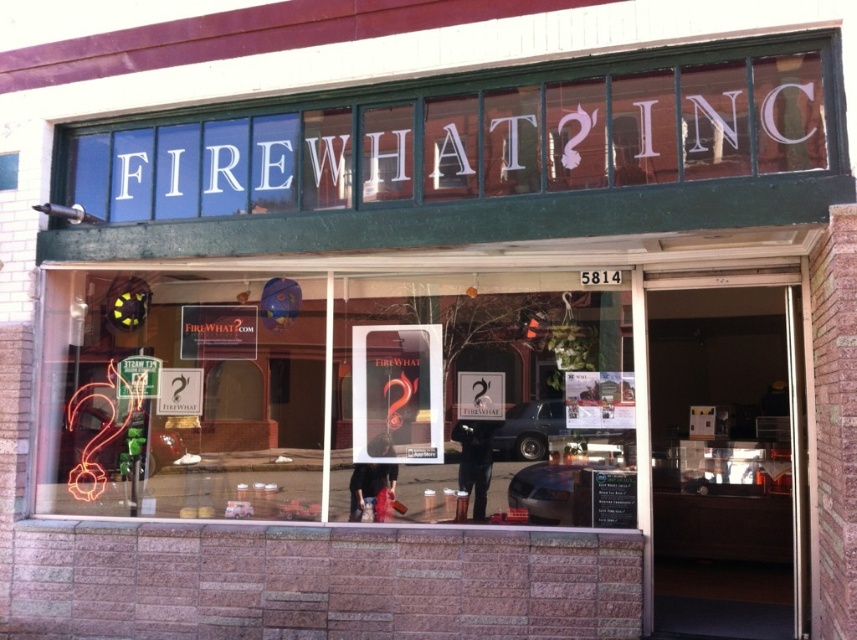
Question: Which of the following is the closest to the observer?

Choices:
 (A) translucent glass window at center
 (B) neon orange sign at upper center

Answer: (B)

Question: Does translucent glass window at center appear on the left side of neon orange sign at upper center?

Choices:
 (A) no
 (B) yes

Answer: (B)

Question: Is translucent glass window at center above neon orange sign at upper center?

Choices:
 (A) no
 (B) yes

Answer: (A)

Question: Can you confirm if translucent glass window at center is wider than neon orange sign at upper center?

Choices:
 (A) yes
 (B) no

Answer: (B)

Question: Which point is closer to the camera?

Choices:
 (A) neon orange sign at upper center
 (B) translucent glass window at center

Answer: (A)